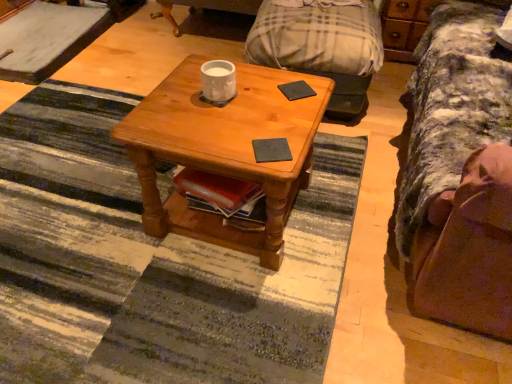
Image resolution: width=512 pixels, height=384 pixels. I want to click on vacant space behind black matte pad at center, the first pad when ordered from top to bottom, so click(x=284, y=75).